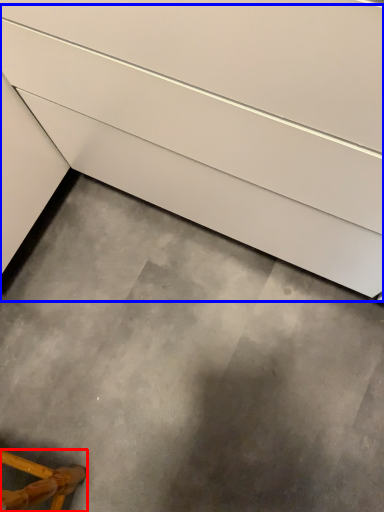
Question: Which object appears farthest to the camera in this image, furniture (highlighted by a red box) or stairs (highlighted by a blue box)?

Choices:
 (A) furniture
 (B) stairs

Answer: (A)